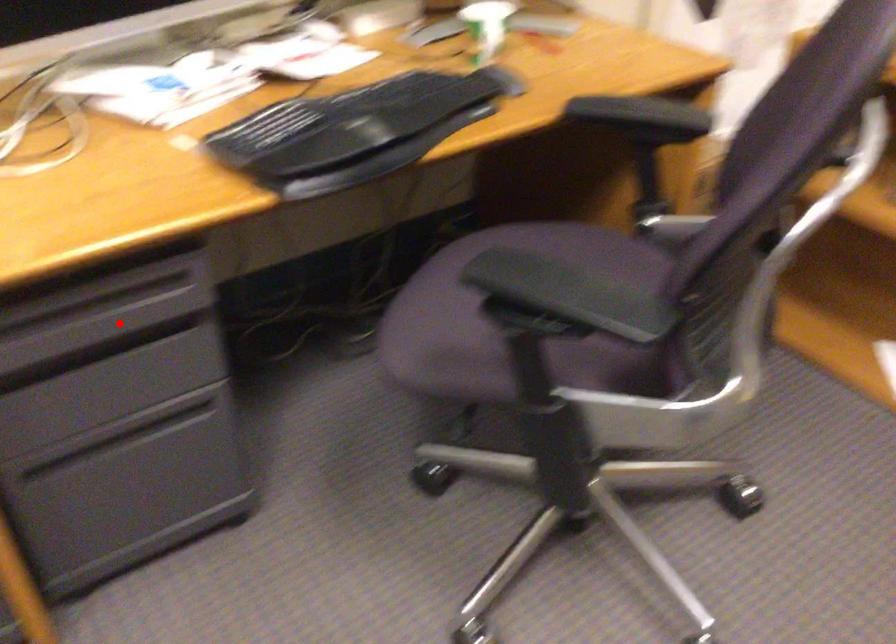
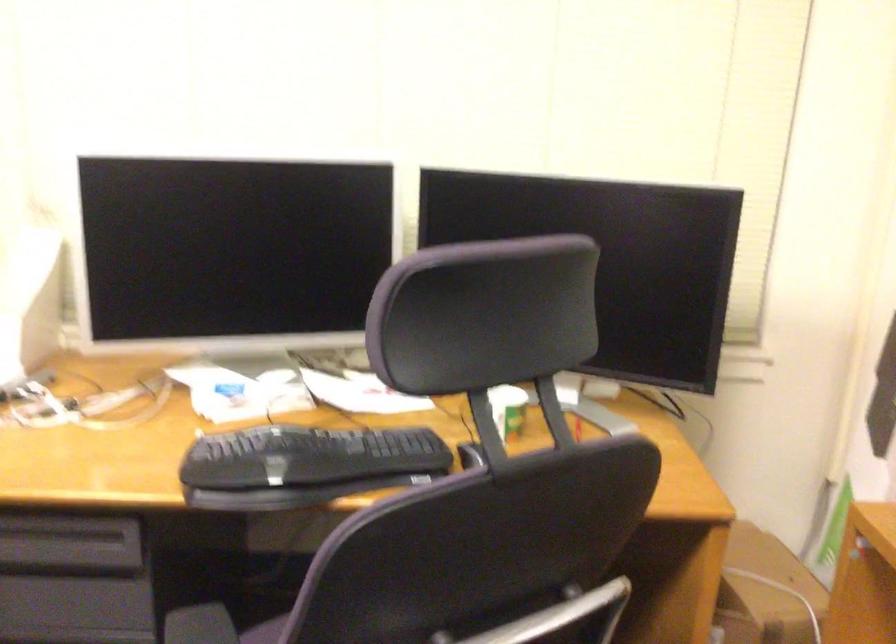
In the second image, find the point that corresponds to the highlighted location in the first image.

(66, 552)